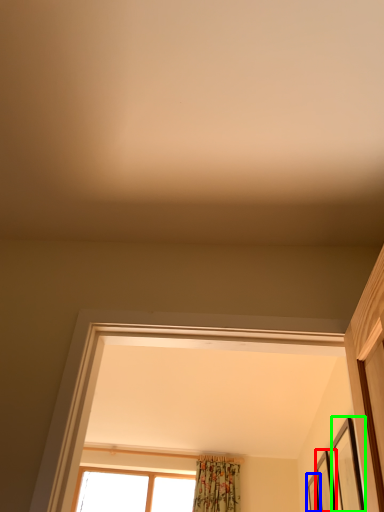
Question: Which object is the closest to the picture frame (highlighted by a red box)? Choose among these: picture frame (highlighted by a blue box) or picture frame (highlighted by a green box).

Choices:
 (A) picture frame
 (B) picture frame

Answer: (A)